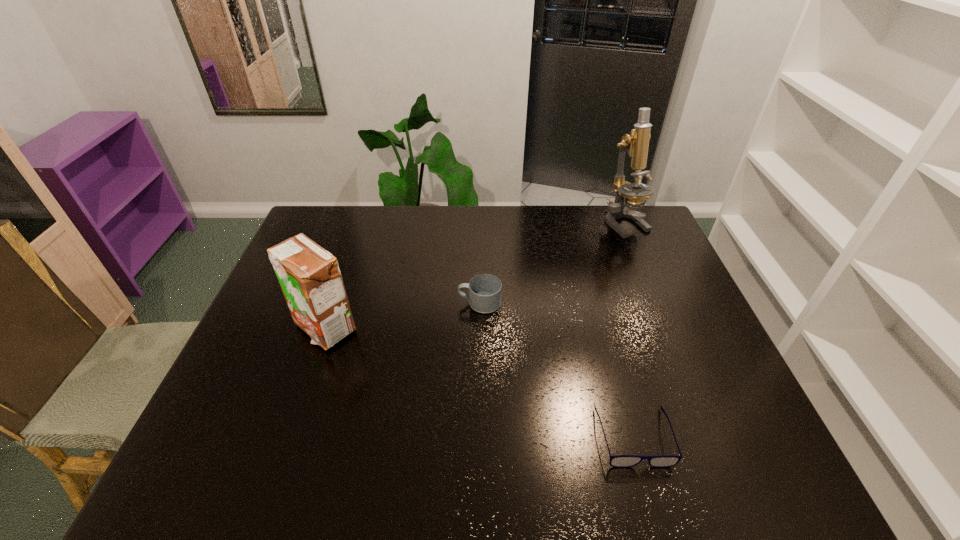
At what (x,y) coordinates should I click in order to perform the action: click on vacant space at the right edge. Please return your answer as a coordinate pair (x, y). Looking at the image, I should click on coord(705,382).

Where is `free spot at the far right corner of the desktop`? The image size is (960, 540). free spot at the far right corner of the desktop is located at coordinates (604, 207).

Where is `free spot between the second object from left to right and the tallest object`? Image resolution: width=960 pixels, height=540 pixels. free spot between the second object from left to right and the tallest object is located at coordinates (552, 262).

Where is `vacant area that lies between the second tallest object and the tallest object`? This screenshot has width=960, height=540. vacant area that lies between the second tallest object and the tallest object is located at coordinates (474, 275).

Find the location of a particular element. The width and height of the screenshot is (960, 540). unoccupied position between the mug and the nearest object is located at coordinates (557, 370).

In order to click on free space between the leftmost object and the nearest object in this screenshot , I will do `click(479, 382)`.

What are the coordinates of `free space between the farthest object and the second object from right to left` in the screenshot? It's located at (629, 329).

At what (x,y) coordinates should I click in order to perform the action: click on free space between the tallest object and the second object from right to left. Please return your answer as a coordinate pair (x, y). The width and height of the screenshot is (960, 540). Looking at the image, I should click on (629, 329).

Locate an element on the screen. The width and height of the screenshot is (960, 540). vacant area that lies between the shortest object and the second object from left to right is located at coordinates (557, 370).

This screenshot has height=540, width=960. What are the coordinates of `free spot between the spectacles and the second object from left to right` in the screenshot? It's located at (557, 370).